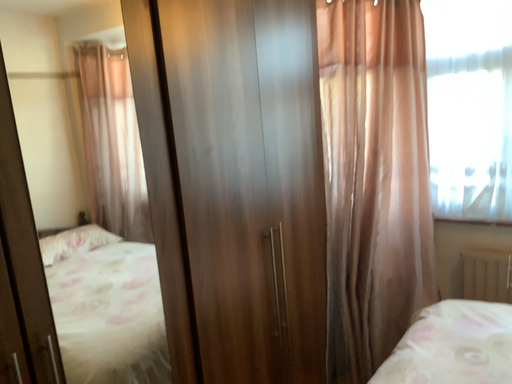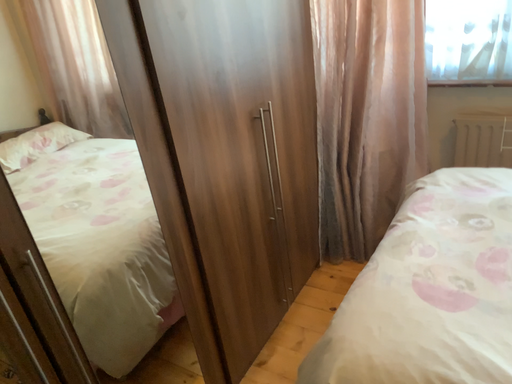
Question: Which way did the camera rotate in the video?

Choices:
 (A) rotated upward
 (B) rotated downward

Answer: (B)